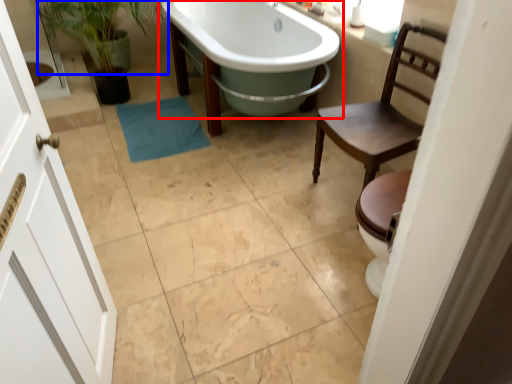
Question: Which of the following is the farthest to the observer, bathtub (highlighted by a red box) or plant (highlighted by a blue box)?

Choices:
 (A) bathtub
 (B) plant

Answer: (B)